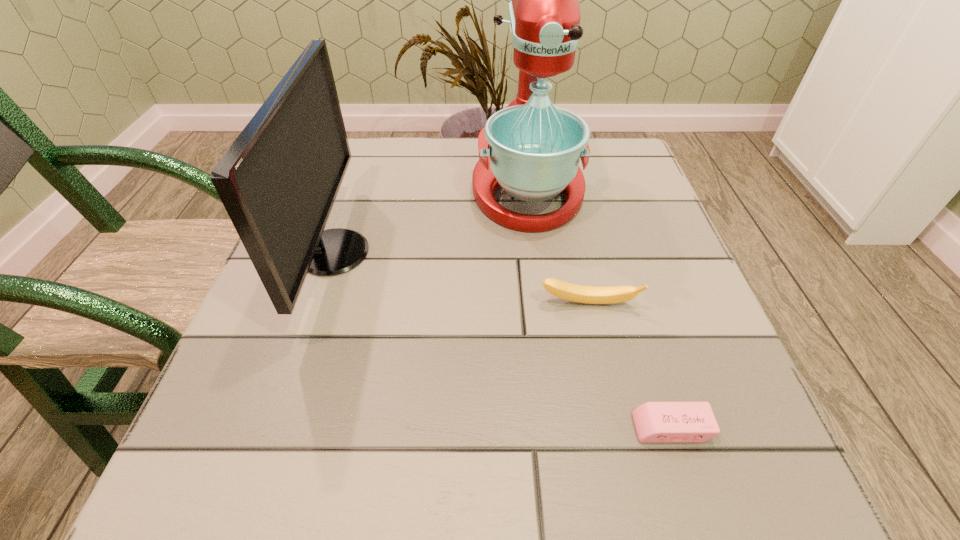
What are the coordinates of `free space that satisfies the following two spatial constraints: 1. on the front-facing side of the leftmost object; 2. on the right side of the nearest object` in the screenshot? It's located at (275, 428).

The width and height of the screenshot is (960, 540). Find the location of `vacant area in the image that satisfies the following two spatial constraints: 1. on the front-facing side of the eraser; 2. on the left side of the tallest object`. vacant area in the image that satisfies the following two spatial constraints: 1. on the front-facing side of the eraser; 2. on the left side of the tallest object is located at coordinates (558, 428).

Find the location of a particular element. The width and height of the screenshot is (960, 540). vacant space that satisfies the following two spatial constraints: 1. on the front-facing side of the tallest object; 2. on the front-facing side of the computer monitor is located at coordinates (536, 252).

Find the location of a particular element. vacant region that satisfies the following two spatial constraints: 1. on the front-facing side of the mixer; 2. on the front-facing side of the computer monitor is located at coordinates (536, 252).